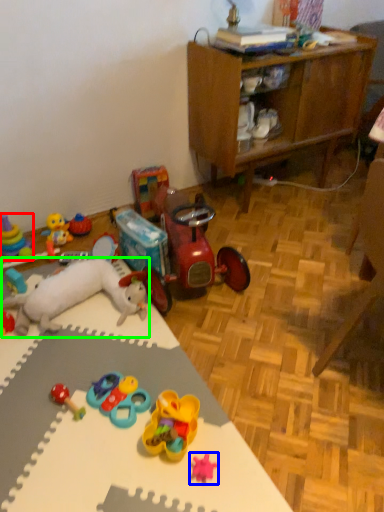
Question: Which object is positioned closest to toy (highlighted by a red box)? Select from toy (highlighted by a blue box) and toy (highlighted by a green box).

Choices:
 (A) toy
 (B) toy

Answer: (B)